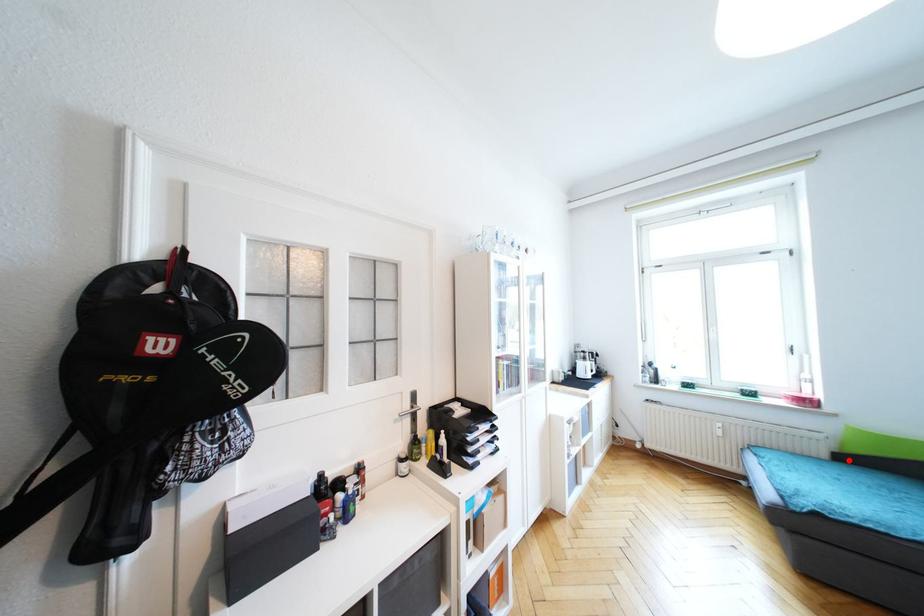
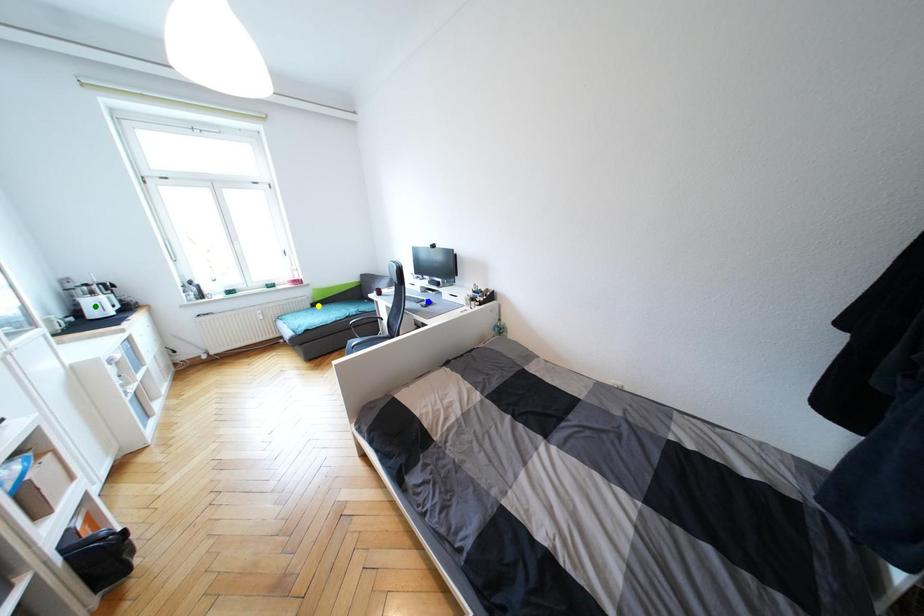
Question: I am providing you with two images of the same scene from different viewpoints. A red point is marked on the first image. You are given multiple points on the second image. Which point in image 2 represents the same 3d spot as the red point in image 1?

Choices:
 (A) yellow point
 (B) blue point
 (C) green point

Answer: (A)